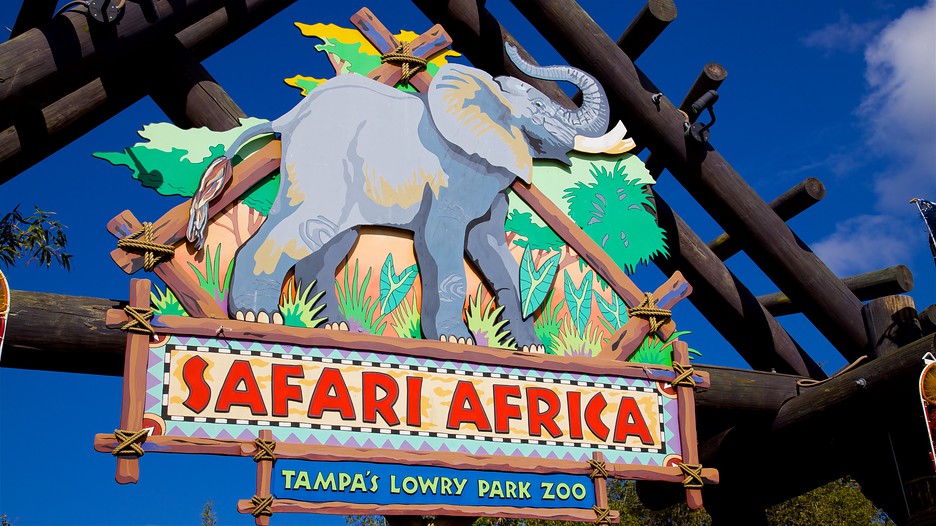
Identify the location of wood structure. This screenshot has width=936, height=526. (727, 196).